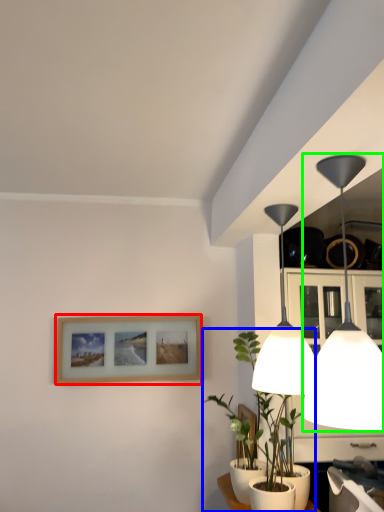
Question: Which object is positioned farthest from picture frame (highlighted by a red box)? Select from houseplant (highlighted by a blue box) and lamp (highlighted by a green box).

Choices:
 (A) houseplant
 (B) lamp

Answer: (B)